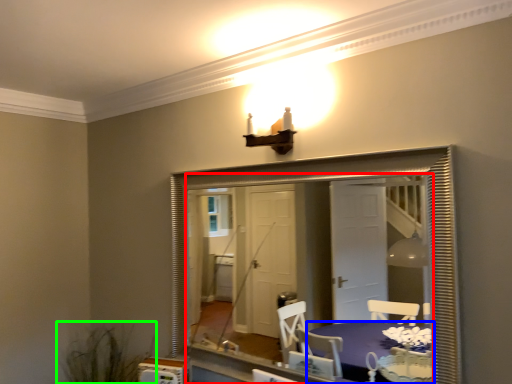
Question: Based on their relative distances, which object is nearer to mirror (highlighted by a red box)? Choose from table (highlighted by a blue box) and plant (highlighted by a green box).

Choices:
 (A) table
 (B) plant

Answer: (A)